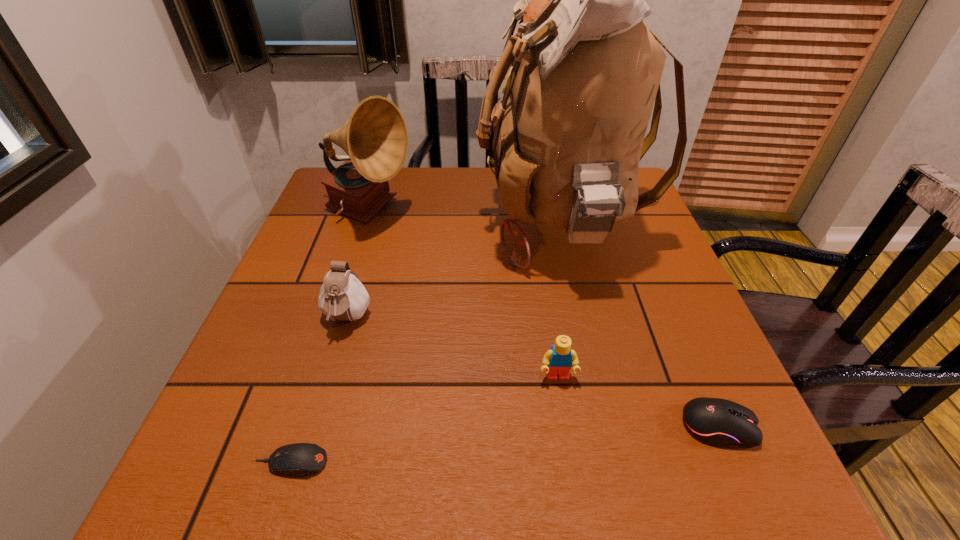
The width and height of the screenshot is (960, 540). In order to click on vacant space located 0.090m on the front-facing side of the tallest object in this screenshot , I will do `click(441, 225)`.

This screenshot has width=960, height=540. Identify the location of vacant space situated 0.190m on the front-facing side of the tallest object. (400, 225).

Locate an element on the screen. This screenshot has height=540, width=960. vacant space located 0.390m on the front-facing side of the tallest object is located at coordinates (322, 225).

Locate an element on the screen. The image size is (960, 540). free space located 0.290m on the horn of the phonograph record is located at coordinates coord(526,213).

Locate an element on the screen. vacant area situated on the front-facing side of the fourth shortest object is located at coordinates (322, 408).

The image size is (960, 540). Find the location of `free location located 0.140m on the front-facing side of the Lego`. free location located 0.140m on the front-facing side of the Lego is located at coordinates (570, 466).

Image resolution: width=960 pixels, height=540 pixels. I want to click on free region located 0.290m on the back of the taller computer mouse, so click(659, 285).

Identify the location of vacant space located on the back of the shorter computer mouse. click(338, 314).

This screenshot has height=540, width=960. I want to click on backpack at the far edge, so click(x=585, y=71).

You are a GUI agent. You are given a task and a screenshot of the screen. Output one action in this format:
    pyautogui.click(x=<x>, y=<y>)
    Task: Click on the phonograph record present at the far edge
    The width and height of the screenshot is (960, 540).
    Given the screenshot: What is the action you would take?
    pyautogui.click(x=375, y=138)